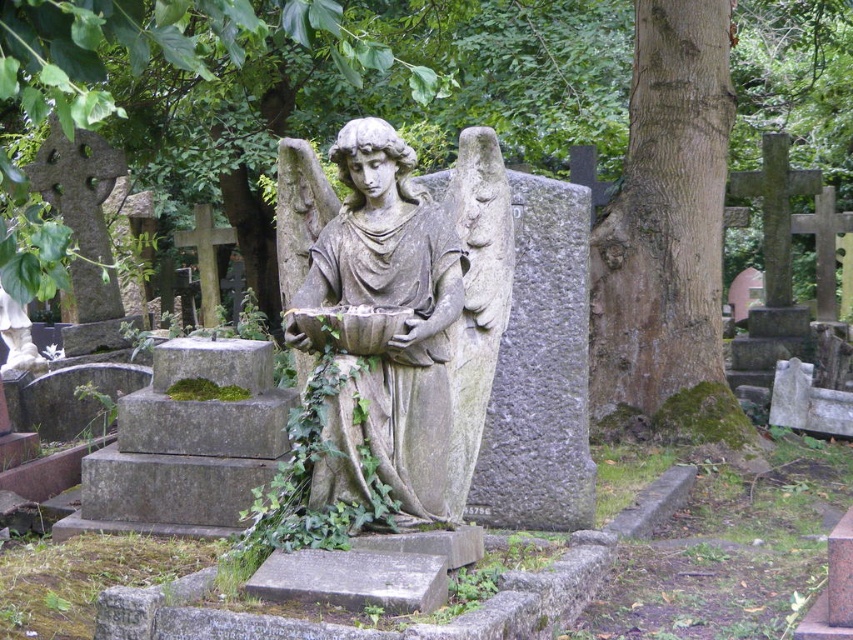
Between stone statue at center and green mossy bark at center, which one has less height?

stone statue at center

Which is below, stone statue at center or green mossy bark at center?

stone statue at center is lower down.

The image size is (853, 640). Describe the element at coordinates (407, 312) in the screenshot. I see `stone statue at center` at that location.

This screenshot has height=640, width=853. In order to click on stone statue at center in this screenshot , I will do `click(407, 312)`.